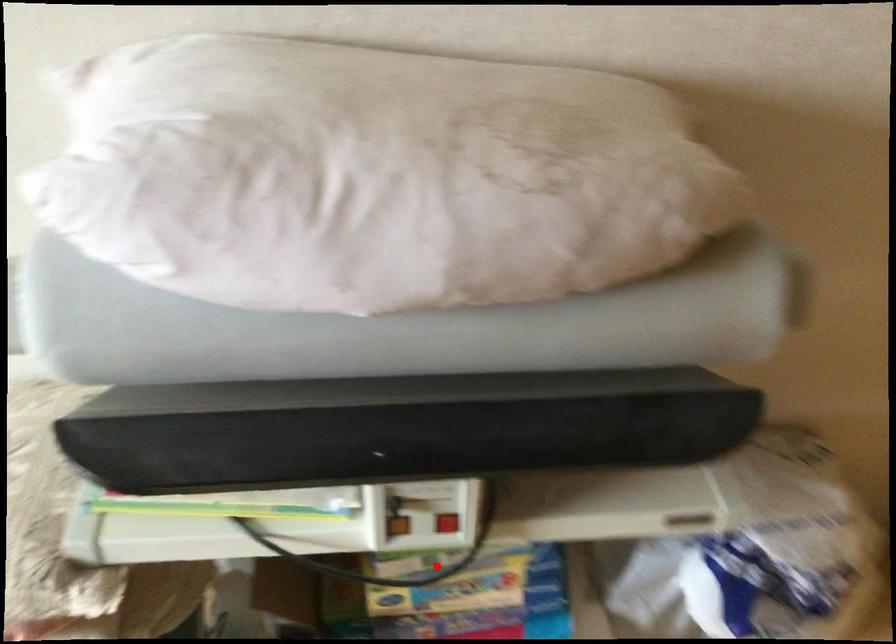
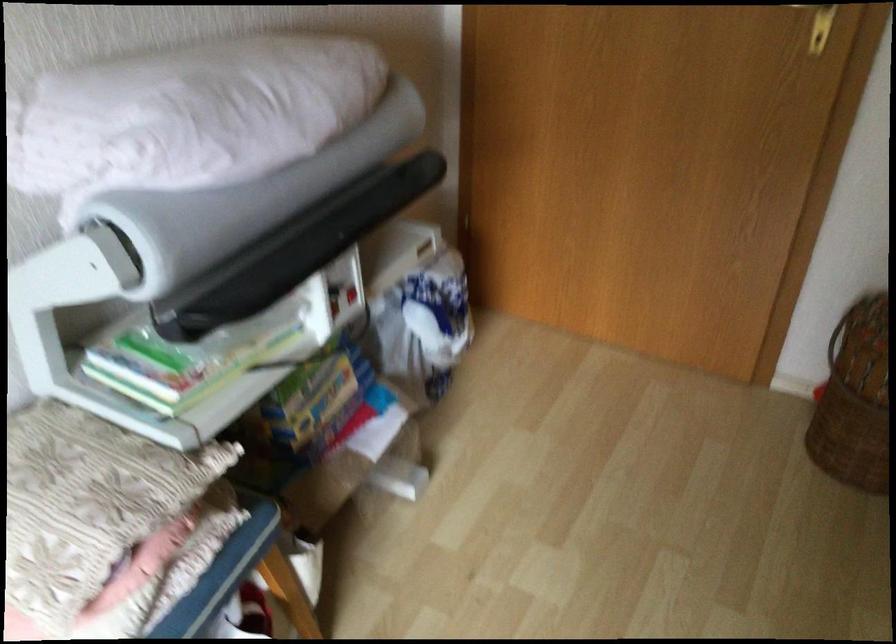
Question: I am providing you with two images of the same scene from different viewpoints. Given a red point in image1, look at the same physical point in image2. Is it:

Choices:
 (A) Closer to the viewpoint
 (B) Farther from the viewpoint

Answer: (B)